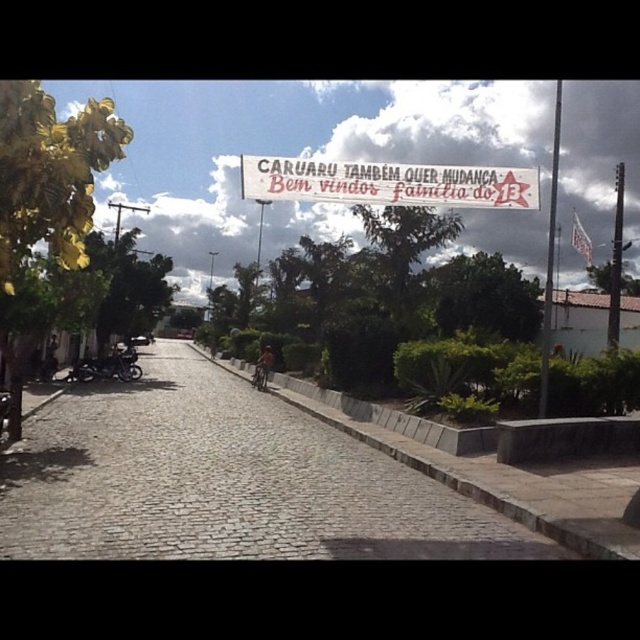
You are a delivery person with a 1.2 meter wide cart. You need to navigate through the cobblestone pavement at center and under the white paper banner at center. Can your cart pass through without touching the banner?

The cobblestone pavement at center is smaller than the white paper banner at center. Since the banner is larger, it might have enough clearance for the cart. However, the pavement being smaller could mean it is narrower than the banner. If the pavement is narrower than 1.2 meters, the cart may not fit. The banner size doesn not directly indicate the path width. Without knowing the pavement width, it is uncertain if the cart can pass safely.

You are a pedestrian standing on the sidewalk on the right side of the street. You want to look at the shiny black motorcycle at left but also see the white paper banner at center. Which object will you see first when looking towards the street?

The shiny black motorcycle at left will be seen first because the white paper banner at center is positioned on the right side of it, meaning the motorcycle is closer to your line of sight from the sidewalk.